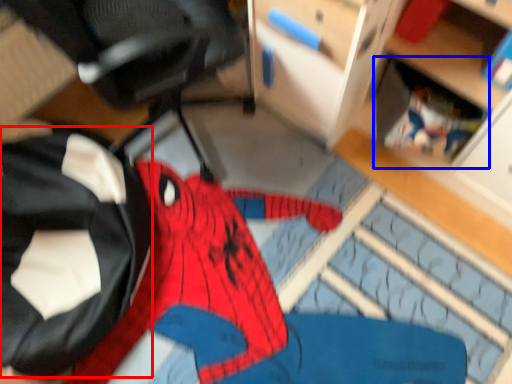
Question: Among these objects, which one is farthest to the camera, clothing (highlighted by a red box) or shelf (highlighted by a blue box)?

Choices:
 (A) clothing
 (B) shelf

Answer: (B)